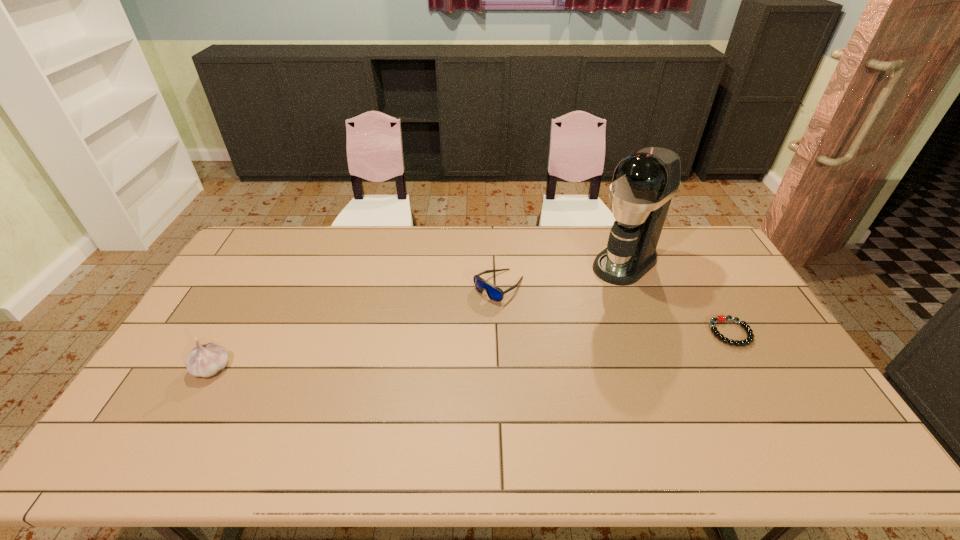
At what (x,y) coordinates should I click in order to perform the action: click on free space located place cup under the spout of the third object from left to right. Please return your answer as a coordinate pair (x, y). The width and height of the screenshot is (960, 540). Looking at the image, I should click on (567, 311).

Where is `free space located place cup under the spout of the third object from left to right`? free space located place cup under the spout of the third object from left to right is located at coordinates (535, 338).

Locate an element on the screen. free region located place cup under the spout of the third object from left to right is located at coordinates (550, 326).

Where is `vacant position located on the front-facing side of the sunglasses`? vacant position located on the front-facing side of the sunglasses is located at coordinates (451, 323).

Where is `free space located 0.240m on the front-facing side of the sunglasses`? free space located 0.240m on the front-facing side of the sunglasses is located at coordinates (428, 341).

At what (x,y) coordinates should I click in order to perform the action: click on vacant space situated 0.310m on the front-facing side of the sunglasses. Please return your answer as a coordinate pair (x, y). Looking at the image, I should click on (410, 355).

Where is `object at the far edge`? This screenshot has height=540, width=960. object at the far edge is located at coordinates (644, 183).

You are a GUI agent. You are given a task and a screenshot of the screen. Output one action in this format:
    pyautogui.click(x=<x>, y=<y>)
    Task: Click on the object located in the left edge section of the desktop
    
    Given the screenshot: What is the action you would take?
    pyautogui.click(x=205, y=360)

This screenshot has height=540, width=960. In order to click on object that is at the right edge in this screenshot , I will do `click(720, 318)`.

In the image, there is a desktop. Where is `free space at the far edge`? free space at the far edge is located at coordinates (466, 262).